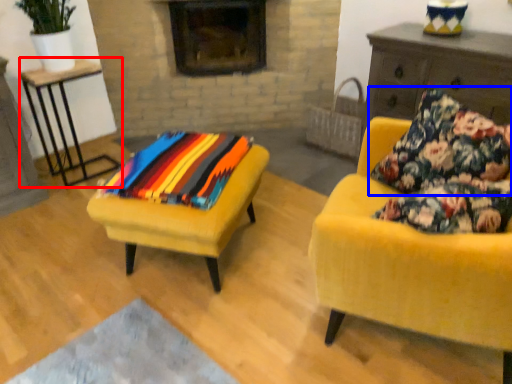
Question: Among these objects, which one is nearest to the camera, table (highlighted by a red box) or pillow (highlighted by a blue box)?

Choices:
 (A) table
 (B) pillow

Answer: (B)